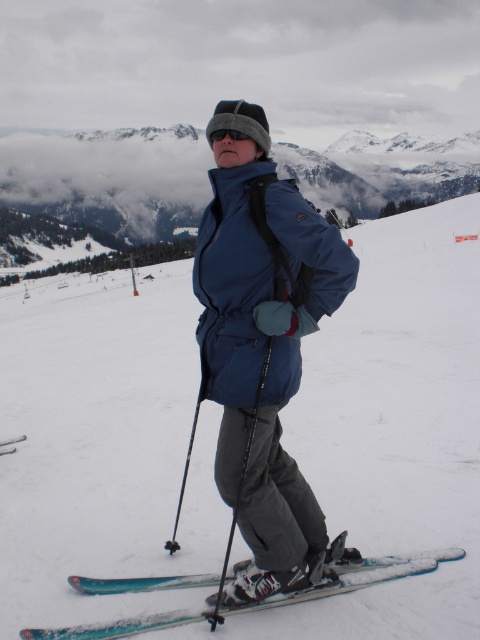
You are a ski equipment inspector checking the width of the skis in the image. The teal glossy skis at lower center and the blue metallic ski at lower left are both on the snow. According to the equipment standards, the minimum width for a ski is 120 cm. Can you determine if both skis meet the minimum width requirement?

The teal glossy skis at lower center might be wider than blue metallic ski at lower left, but without specific measurements, it is impossible to confirm if either meets the 120 cm minimum width requirement.

You are a winter sports instructor observing a skier on the blue fabric ski slope at center and the teal glossy skis at lower center. Which object is positioned higher in the image?

The blue fabric ski slope at center is positioned higher than the teal glossy skis at lower center.

You are standing at point (103, 445) on a snowy slope. What object is located exactly at your current position?

The blue fabric ski slope at center is located exactly at point (103, 445).